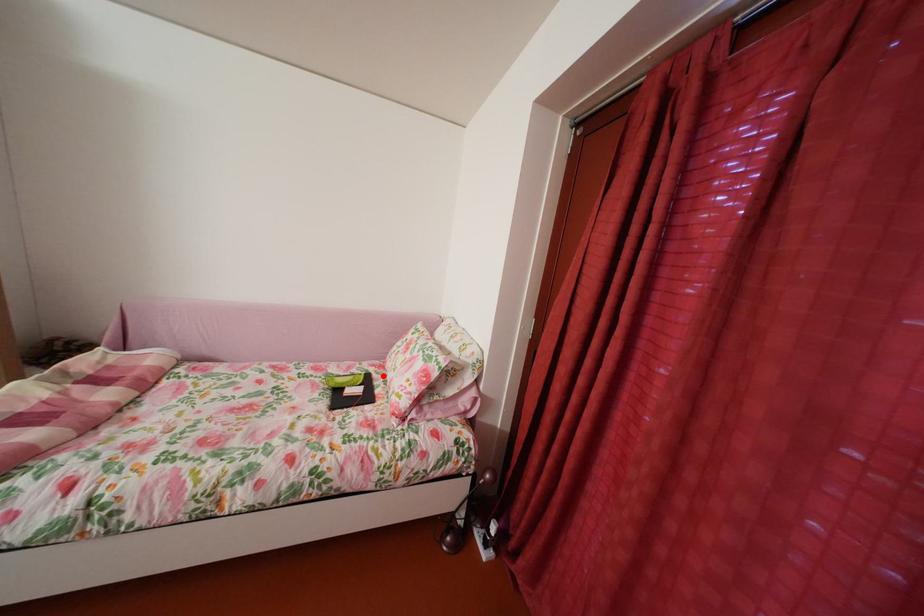
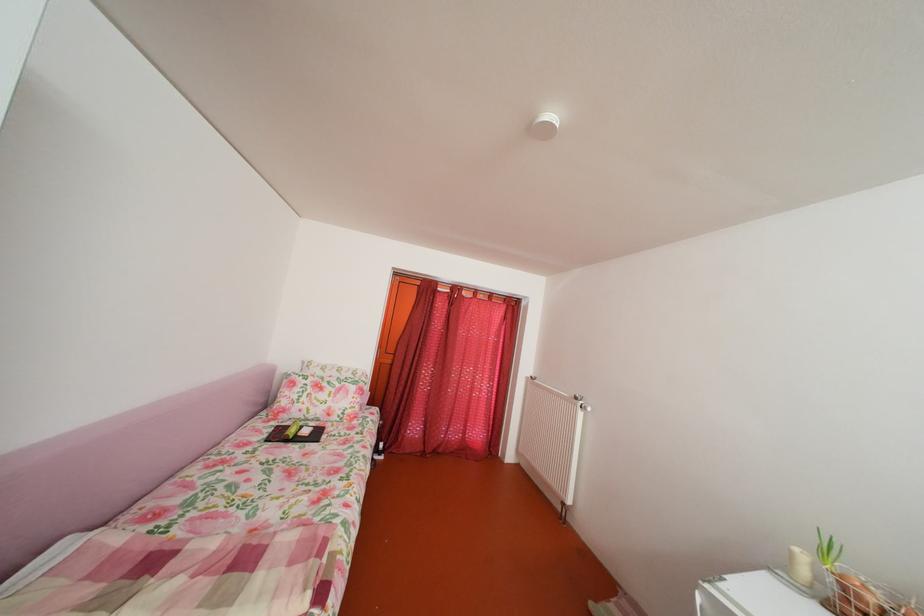
Find the pixel in the second image that matches the highlighted location in the first image.

(286, 430)